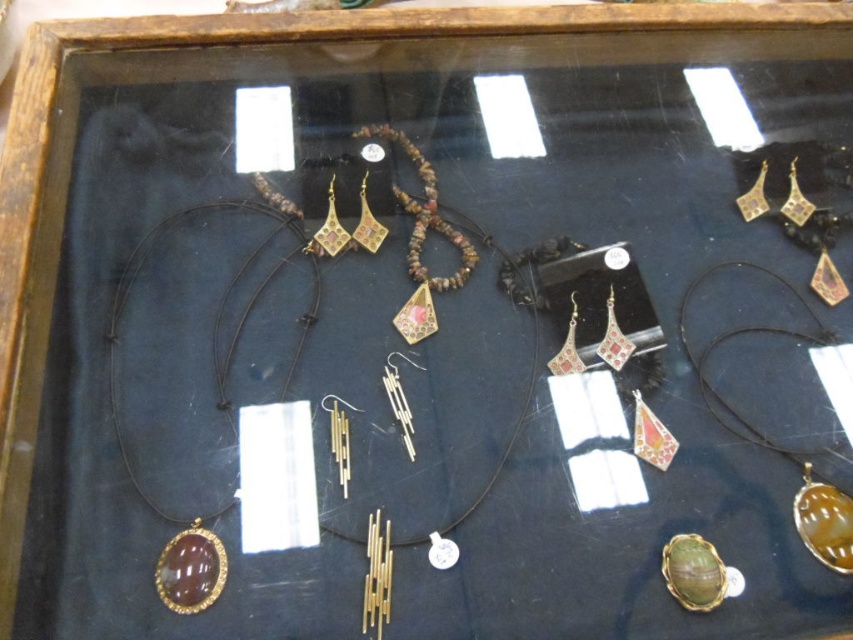
Question: Which object is farther from the camera taking this photo?

Choices:
 (A) gold/polished stone pendant at lower left
 (B) green stone pendant at lower right

Answer: (B)

Question: Does green stone pendant at lower right have a lesser width compared to gold/polished stone pendant at lower left?

Choices:
 (A) no
 (B) yes

Answer: (B)

Question: Does green stone pendant at lower right have a greater width compared to gold/polished stone pendant at lower left?

Choices:
 (A) no
 (B) yes

Answer: (A)

Question: Can you confirm if green stone pendant at lower right is wider than gold/polished stone pendant at lower left?

Choices:
 (A) no
 (B) yes

Answer: (A)

Question: Among these objects, which one is farthest from the camera?

Choices:
 (A) green stone pendant at lower right
 (B) gold/polished stone pendant at lower left

Answer: (A)